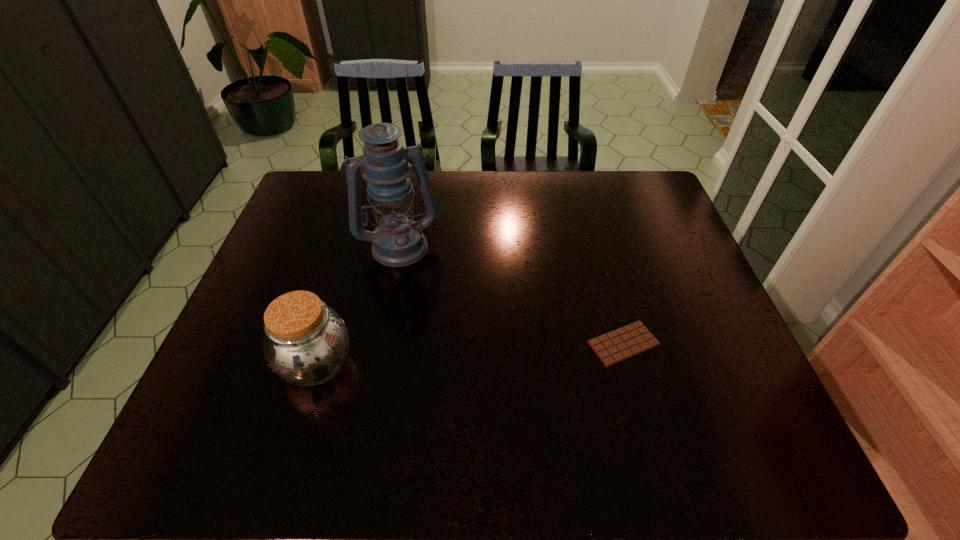
The height and width of the screenshot is (540, 960). I want to click on vacant space in between the farthest object and the rightmost object, so click(x=512, y=294).

This screenshot has height=540, width=960. In order to click on vacant point located between the lantern and the shortest object in this screenshot , I will do `click(512, 294)`.

You are a GUI agent. You are given a task and a screenshot of the screen. Output one action in this format:
    pyautogui.click(x=<x>, y=<y>)
    Task: Click on the empty space that is in between the lantern and the rightmost object
    Image resolution: width=960 pixels, height=540 pixels.
    Given the screenshot: What is the action you would take?
    point(512,294)

The height and width of the screenshot is (540, 960). I want to click on free spot between the lantern and the jar, so coord(358,304).

Locate an element on the screen. The image size is (960, 540). object that is the second closest to the tallest object is located at coordinates (618, 345).

I want to click on object that is the second closest to the jar, so click(x=618, y=345).

The width and height of the screenshot is (960, 540). I want to click on vacant space that satisfies the following two spatial constraints: 1. on the front side of the candy bar; 2. on the right side of the farthest object, so coord(381,343).